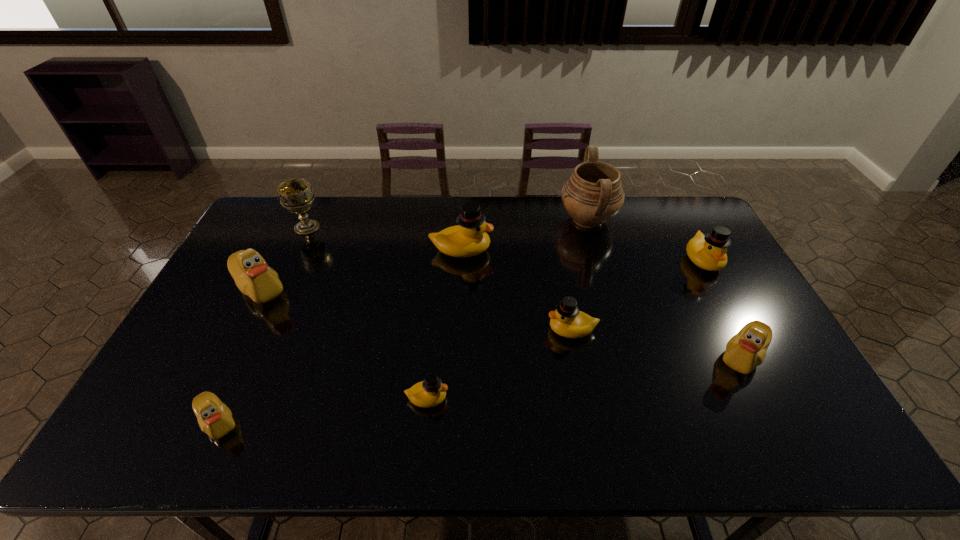
Image resolution: width=960 pixels, height=540 pixels. What are the coordinates of `vacant region located at the beak of the second biggest beige duck` in the screenshot? It's located at (641, 356).

What are the coordinates of `vacant region located on the front-facing side of the third duck from right to left` in the screenshot? It's located at (518, 329).

Identify the location of free location located 0.170m on the front-facing side of the third duck from right to left. (487, 329).

This screenshot has width=960, height=540. Find the location of `blank space located on the front-facing side of the third duck from right to left`. blank space located on the front-facing side of the third duck from right to left is located at coordinates (416, 329).

Find the location of a particular element. vacant space located on the front-facing side of the nearest yellow duck is located at coordinates (493, 398).

Where is `urn that is at the far edge`? urn that is at the far edge is located at coordinates (593, 194).

Where is `chalice that is at the far edge`? The image size is (960, 540). chalice that is at the far edge is located at coordinates (296, 195).

Locate an element on the screen. The image size is (960, 540). object at the near edge is located at coordinates (215, 419).

Locate an element on the screen. Image resolution: width=960 pixels, height=540 pixels. chalice that is at the left edge is located at coordinates (296, 195).

At what (x,y) coordinates should I click in order to perform the action: click on object that is at the far left corner. Please return your answer as a coordinate pair (x, y). The height and width of the screenshot is (540, 960). Looking at the image, I should click on (296, 195).